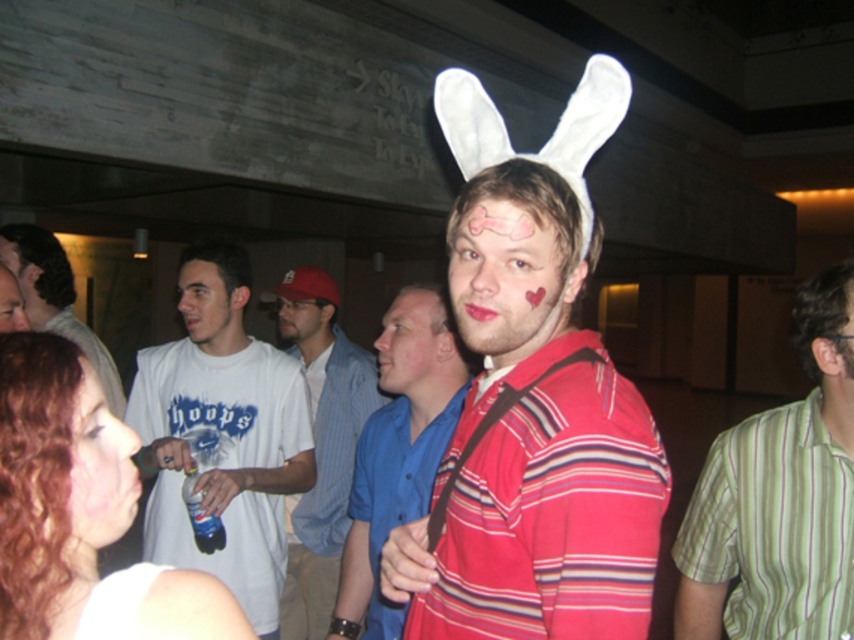
Question: Based on their relative distances, which object is farther from the white shirt at center?

Choices:
 (A) matte red shirt at center
 (B) smooth skin face at lower left
 (C) white cotton shirt at center
 (D) matte skin face at lower left

Answer: (B)

Question: Which point is farther from the camera taking this photo?

Choices:
 (A) (308, 436)
 (B) (512, 301)
 (C) (80, 340)

Answer: (C)

Question: Where is green striped shirt at right located in relation to matte white face at center in the image?

Choices:
 (A) above
 (B) below

Answer: (B)

Question: Can you confirm if matte red shirt at center is bigger than matte skin face at lower left?

Choices:
 (A) yes
 (B) no

Answer: (A)

Question: Is white cotton shirt at center to the right of smooth skin face at center from the viewer's perspective?

Choices:
 (A) yes
 (B) no

Answer: (B)

Question: Which point is closer to the camera taking this photo?

Choices:
 (A) (375, 404)
 (B) (431, 406)

Answer: (B)